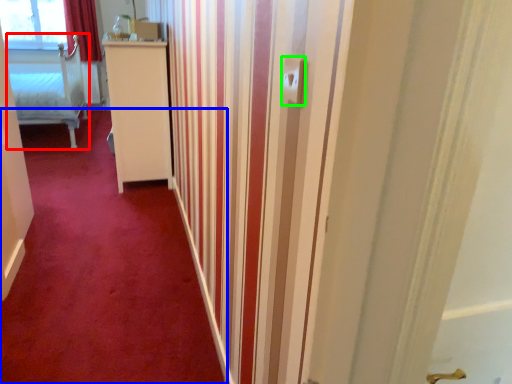
Question: Based on their relative distances, which object is nearer to furniture (highlighted by a red box)? Choose from plain (highlighted by a blue box) and electric outlet (highlighted by a green box).

Choices:
 (A) plain
 (B) electric outlet

Answer: (A)